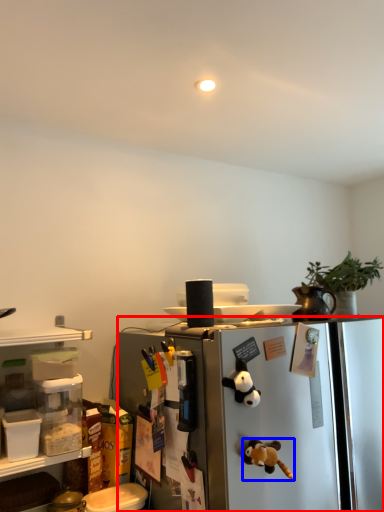
Question: Among these objects, which one is nearest to the camera, refrigerator (highlighted by a red box) or toy (highlighted by a blue box)?

Choices:
 (A) refrigerator
 (B) toy

Answer: (A)